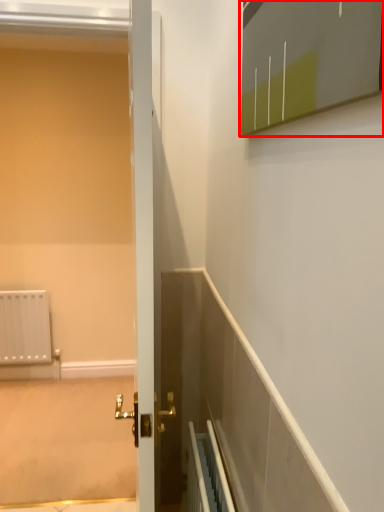
Question: Where is medicine cabinet (annotated by the red box) located in relation to screen door in the image?

Choices:
 (A) left
 (B) right

Answer: (B)